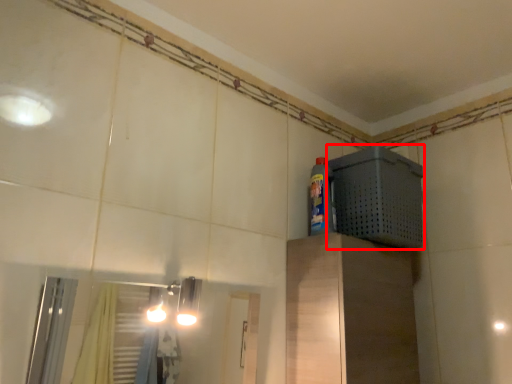
Question: From the image's perspective, what is the correct spatial relationship of appliance (annotated by the red box) in relation to bottle?

Choices:
 (A) below
 (B) above

Answer: (A)